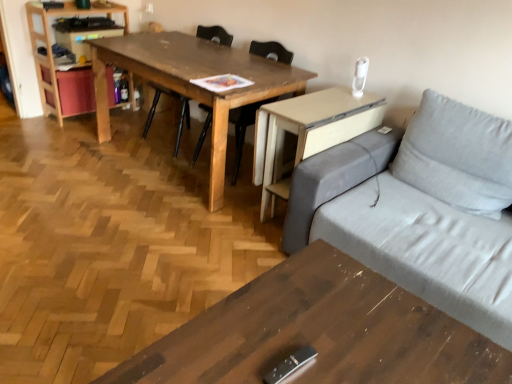
The image size is (512, 384). In order to click on free space that is to the left of wooden chair at center, the second chair in the right-to-left sequence in this screenshot , I will do `click(120, 130)`.